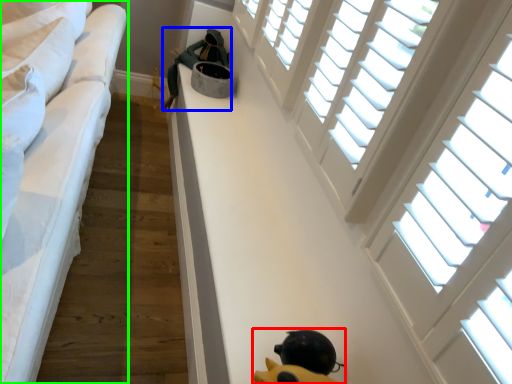
Question: Based on their relative distances, which object is farther from toy (highlighted by a red box)? Choose from person (highlighted by a blue box) and furniture (highlighted by a green box).

Choices:
 (A) person
 (B) furniture

Answer: (A)